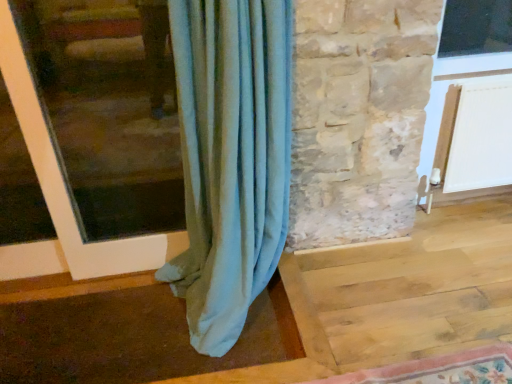
Identify the location of rug with floral pattern at lower right. (439, 369).

Measure the distance between point [79,193] and camera.

2.22 meters.

I want to click on white plastic screen door at upper right, so click(x=464, y=64).

Describe the element at coordinates (464, 64) in the screenshot. The width and height of the screenshot is (512, 384). I see `white plastic screen door at upper right` at that location.

Where is `rug with floral pattern at lower right`? The width and height of the screenshot is (512, 384). rug with floral pattern at lower right is located at coordinates (439, 369).

In terms of width, does white plastic screen door at upper right look wider or thinner when compared to rug with floral pattern at lower right?

Considering their sizes, white plastic screen door at upper right looks slimmer than rug with floral pattern at lower right.

Is white plastic screen door at upper right inside or outside of rug with floral pattern at lower right?

The correct answer is: outside.

From a real-world perspective, who is located higher, white plastic screen door at upper right or rug with floral pattern at lower right?

white plastic screen door at upper right.

Based on the photo, does matte white window frame at left have a smaller size compared to rug with floral pattern at lower right?

No, matte white window frame at left is not smaller than rug with floral pattern at lower right.

Is matte white window frame at left outside of rug with floral pattern at lower right?

Yes, matte white window frame at left is outside of rug with floral pattern at lower right.

Is rug with floral pattern at lower right at the back of matte white window frame at left?

No, matte white window frame at left's orientation is not away from rug with floral pattern at lower right.

Could white plastic screen door at upper right be considered to be inside matte white window frame at left?

No.

Which is in front, matte white window frame at left or white plastic screen door at upper right?

matte white window frame at left is closer to the camera.

Is matte white window frame at left placed right next to white plastic screen door at upper right?

No, matte white window frame at left is not with white plastic screen door at upper right.

From a real-world perspective, which object stands above the other?

From a 3D spatial view, white plastic screen door at upper right is above.

Which is in front, rug with floral pattern at lower right or white plastic screen door at upper right?

Positioned in front is rug with floral pattern at lower right.

Would you say rug with floral pattern at lower right is inside or outside white plastic screen door at upper right?

rug with floral pattern at lower right exists outside the volume of white plastic screen door at upper right.

Where is `mat that is on the left side of white plastic screen door at upper right`? This screenshot has height=384, width=512. mat that is on the left side of white plastic screen door at upper right is located at coordinates (439, 369).

From a real-world perspective, is rug with floral pattern at lower right positioned above or below white plastic screen door at upper right?

rug with floral pattern at lower right is situated lower than white plastic screen door at upper right in the real world.

From a real-world perspective, who is located lower, rug with floral pattern at lower right or matte white window frame at left?

rug with floral pattern at lower right is physically lower.

Relative to matte white window frame at left, is rug with floral pattern at lower right in front or behind?

Clearly, rug with floral pattern at lower right is in front of matte white window frame at left.

From the picture: Would you say rug with floral pattern at lower right is outside matte white window frame at left?

Absolutely, rug with floral pattern at lower right is external to matte white window frame at left.

Is white plastic screen door at upper right inside the boundaries of matte white window frame at left, or outside?

white plastic screen door at upper right exists outside the volume of matte white window frame at left.

Is white plastic screen door at upper right looking in the opposite direction of matte white window frame at left?

No, white plastic screen door at upper right is not facing the opposite direction of matte white window frame at left.

Is white plastic screen door at upper right shorter than matte white window frame at left?

Yes, white plastic screen door at upper right is shorter than matte white window frame at left.

Is white plastic screen door at upper right smaller than matte white window frame at left?

Actually, white plastic screen door at upper right might be larger than matte white window frame at left.

This screenshot has height=384, width=512. What are the coordinates of `mat below the white plastic screen door at upper right (from a real-world perspective)` in the screenshot? It's located at (439, 369).

Locate an element on the screen. Image resolution: width=512 pixels, height=384 pixels. mat on the right of the matte white window frame at left is located at coordinates tap(439, 369).

Estimate the real-world distances between objects in this image. Which object is further from white plastic screen door at upper right, matte white window frame at left or rug with floral pattern at lower right?

matte white window frame at left is positioned further to the anchor white plastic screen door at upper right.

Estimate the real-world distances between objects in this image. Which object is closer to rug with floral pattern at lower right, matte white window frame at left or white plastic screen door at upper right?

white plastic screen door at upper right is closer to rug with floral pattern at lower right.

Estimate the real-world distances between objects in this image. Which object is further from matte white window frame at left, white plastic screen door at upper right or rug with floral pattern at lower right?

white plastic screen door at upper right is further to matte white window frame at left.

Based on their spatial positions, is rug with floral pattern at lower right or white plastic screen door at upper right closer to matte white window frame at left?

rug with floral pattern at lower right lies closer to matte white window frame at left than the other object.

Which object lies nearer to the anchor point white plastic screen door at upper right, rug with floral pattern at lower right or matte white window frame at left?

rug with floral pattern at lower right.

From the image, which object appears to be nearer to rug with floral pattern at lower right, white plastic screen door at upper right or matte white window frame at left?

Based on the image, white plastic screen door at upper right appears to be nearer to rug with floral pattern at lower right.

Identify the location of mat located between matte white window frame at left and white plastic screen door at upper right in the left-right direction. This screenshot has height=384, width=512. (439, 369).